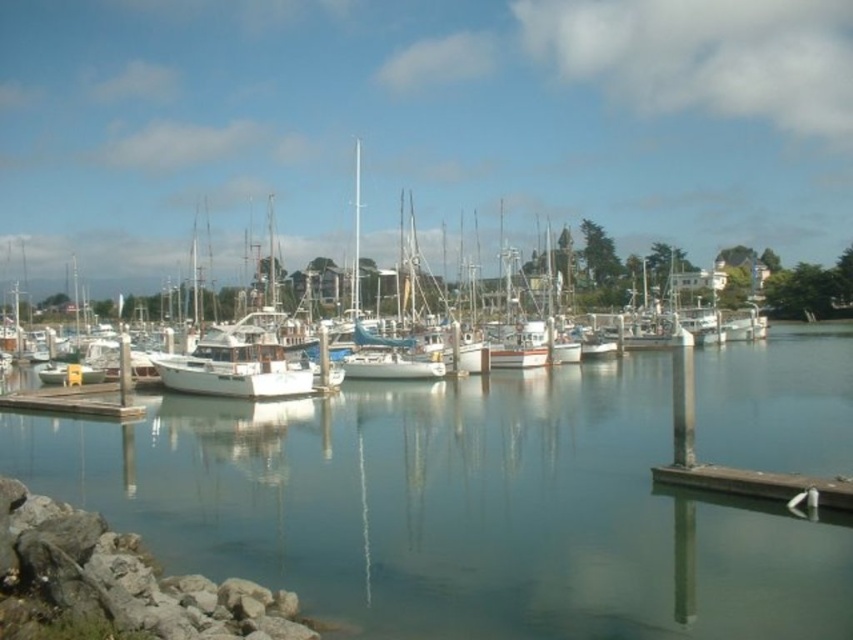
Question: Is white matte boat at center further to the viewer compared to smooth wood dock at lower right?

Choices:
 (A) no
 (B) yes

Answer: (B)

Question: Does white matte boat at center have a smaller size compared to smooth wood dock at lower right?

Choices:
 (A) no
 (B) yes

Answer: (A)

Question: Does white matte boat at center appear under smooth wood dock at lower right?

Choices:
 (A) no
 (B) yes

Answer: (A)

Question: Which of the following is the farthest from the observer?

Choices:
 (A) clear water at center
 (B) wooden dock at lower left
 (C) smooth wood dock at lower right

Answer: (B)

Question: Which object is farther from the camera taking this photo?

Choices:
 (A) clear water at center
 (B) wooden dock at lower left

Answer: (B)

Question: Estimate the real-world distances between objects in this image. Which object is closer to the smooth wood dock at lower right?

Choices:
 (A) wooden dock at lower left
 (B) clear water at center

Answer: (B)